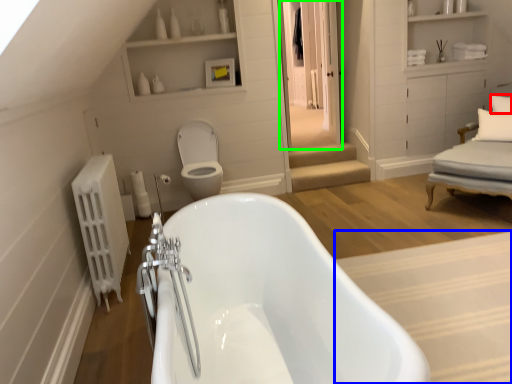
Question: Considering the real-world distances, which object is farthest from pillow (highlighted by a red box)? plain (highlighted by a blue box) or glass door (highlighted by a green box)?

Choices:
 (A) plain
 (B) glass door

Answer: (A)